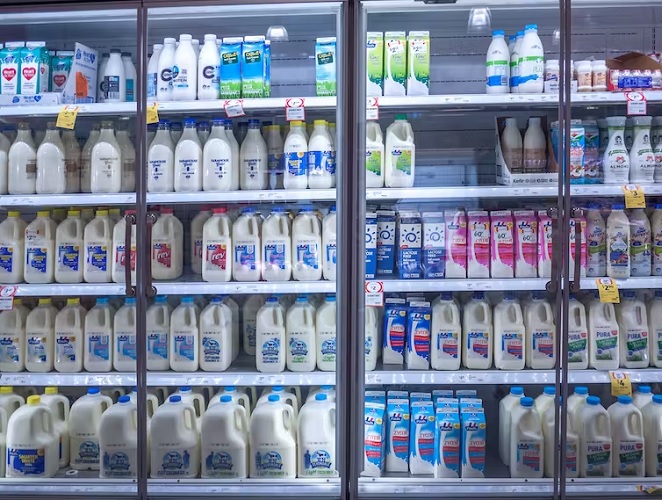
Image resolution: width=662 pixels, height=500 pixels. What are the coordinates of `shelves` in the screenshot? It's located at coord(107,419), coord(83,328), coord(81,236), coord(66,160), coord(73,42).